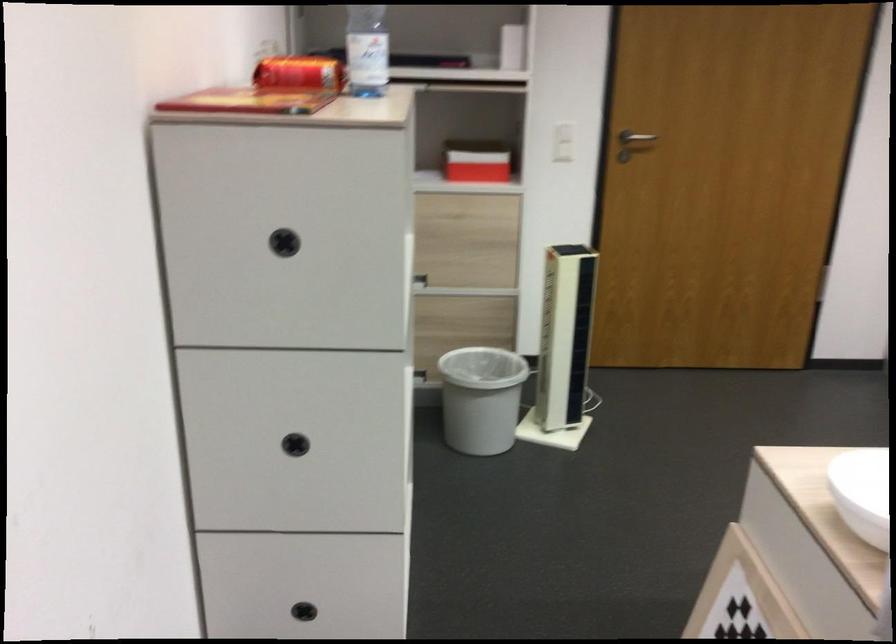
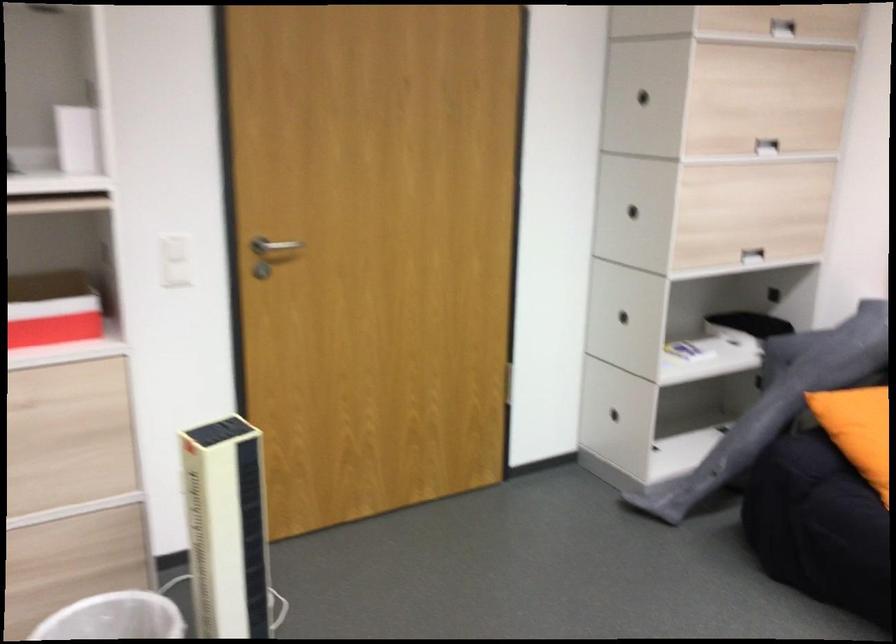
Question: Based on the continuous images, in which direction is the camera rotating? Reply with the corresponding letter.

Choices:
 (A) Left
 (B) Right
 (C) Up
 (D) Down

Answer: (B)